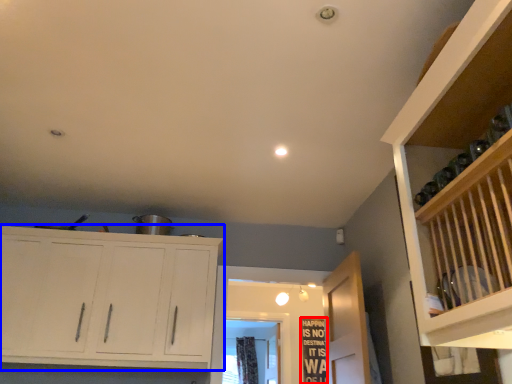
Question: Among these objects, which one is nearest to the camera, bulletin board (highlighted by a red box) or cupboard (highlighted by a blue box)?

Choices:
 (A) bulletin board
 (B) cupboard

Answer: (B)